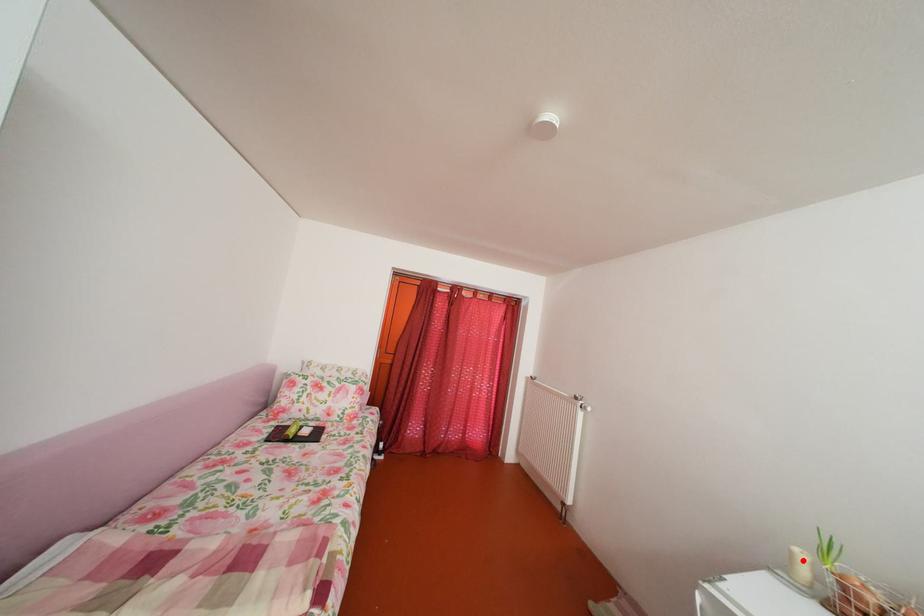
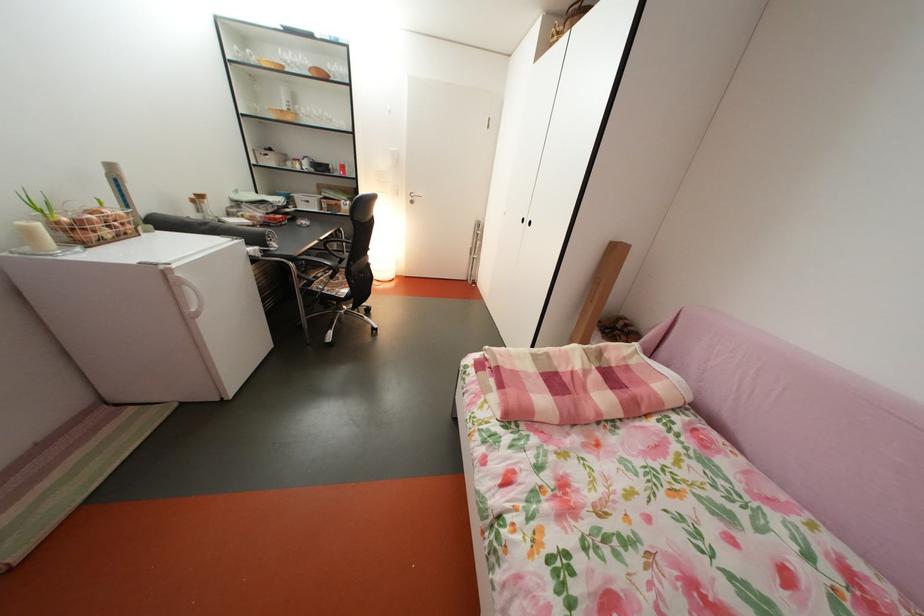
Locate, in the second image, the point that corresponds to the highlighted location in the first image.

(41, 238)